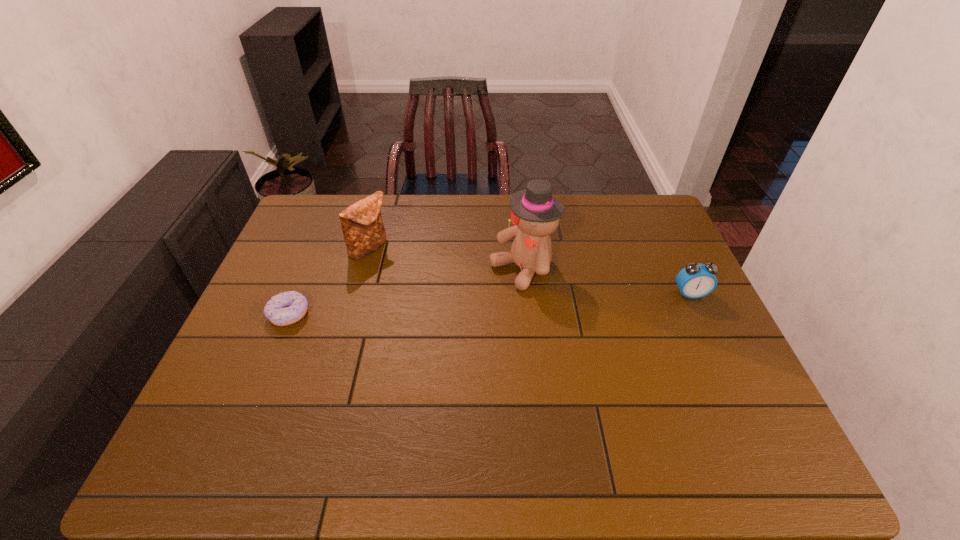
The height and width of the screenshot is (540, 960). Identify the location of free space located 0.090m on the open side of the clutch bag. (398, 273).

The image size is (960, 540). What are the coordinates of `vacant region located 0.180m on the open side of the clutch bag` in the screenshot? It's located at (418, 288).

At what (x,y) coordinates should I click in order to perform the action: click on free space located 0.400m on the open side of the clutch bag. Please return your answer as a coordinate pair (x, y). Looking at the image, I should click on (470, 329).

Identify the location of vacant space situated 0.190m on the front-facing side of the second object from right to left. (446, 316).

Image resolution: width=960 pixels, height=540 pixels. In order to click on free location located on the front-facing side of the second object from right to left in this screenshot , I will do coord(464,306).

I want to click on vacant space located on the front-facing side of the second object from right to left, so click(474, 299).

Find the location of `object positioned at the far edge`. object positioned at the far edge is located at coordinates (363, 230).

I want to click on object located at the left edge, so click(x=286, y=308).

Identify the location of object present at the right edge. (694, 281).

This screenshot has width=960, height=540. Find the location of `vacant space at the far edge`. vacant space at the far edge is located at coordinates (408, 212).